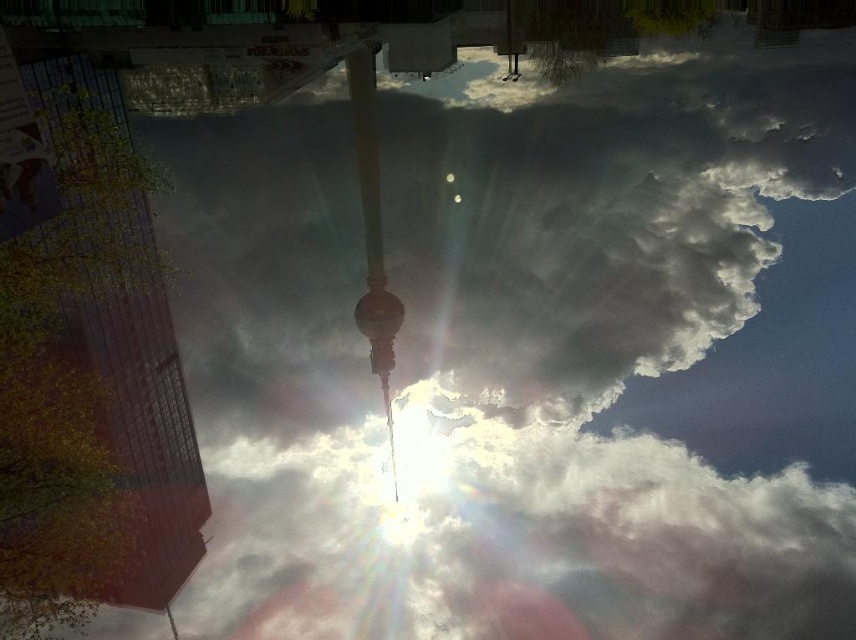
Does glassy reflective tower at left appear on the right side of shiny gold pole at center?

In fact, glassy reflective tower at left is to the left of shiny gold pole at center.

Is point (60, 76) more distant than point (372, 323)?

No, it is not.

Find the location of `glassy reflective tower at left`. glassy reflective tower at left is located at coordinates (149, 435).